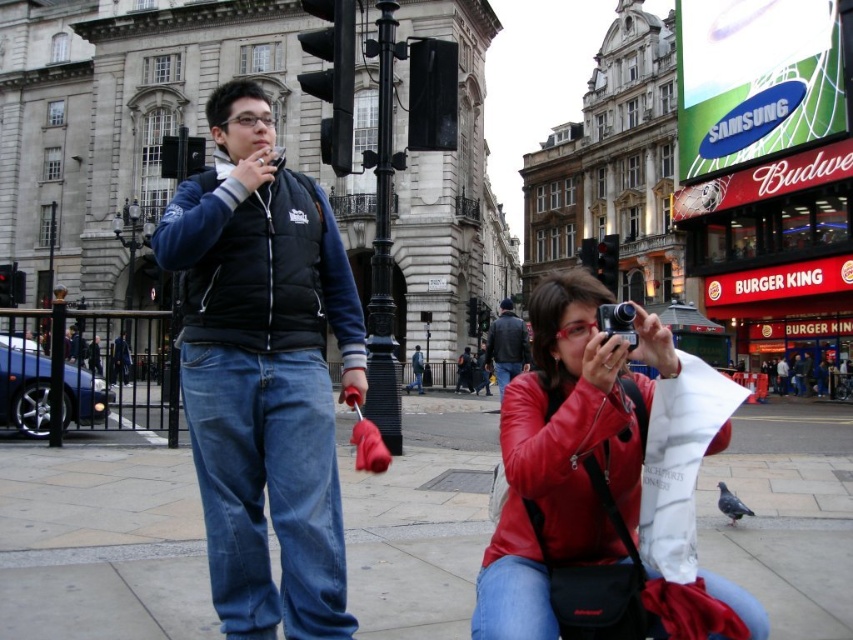
Between matte red leather jacket at lower right and gray matte pigeon at lower right, which one is positioned higher?

matte red leather jacket at lower right

What do you see at coordinates (567, 452) in the screenshot?
I see `matte red leather jacket at lower right` at bounding box center [567, 452].

The image size is (853, 640). Describe the element at coordinates (567, 452) in the screenshot. I see `matte red leather jacket at lower right` at that location.

What are the coordinates of `matte red leather jacket at lower right` in the screenshot? It's located at (567, 452).

Is black matte vest at center to the left of gray matte pigeon at lower right from the viewer's perspective?

Correct, you'll find black matte vest at center to the left of gray matte pigeon at lower right.

From the picture: Is black matte vest at center closer to the viewer compared to gray matte pigeon at lower right?

That is True.

Is point (229, 524) positioned before point (749, 509)?

Yes, point (229, 524) is closer to viewer.

Where is `black matte vest at center`? The height and width of the screenshot is (640, 853). black matte vest at center is located at coordinates (263, 372).

Is point (258, 132) positioned in front of point (502, 317)?

Yes, it is in front of point (502, 317).

Is point (253, 445) closer to camera compared to point (508, 371)?

Yes.

Locate an element on the screen. black matte vest at center is located at coordinates (263, 372).